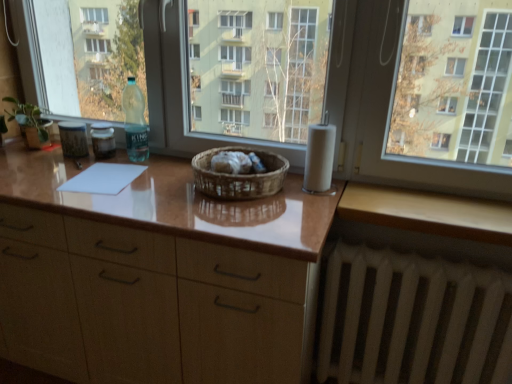
The height and width of the screenshot is (384, 512). I want to click on free location to the right of translucent plastic bottle at left, so click(139, 162).